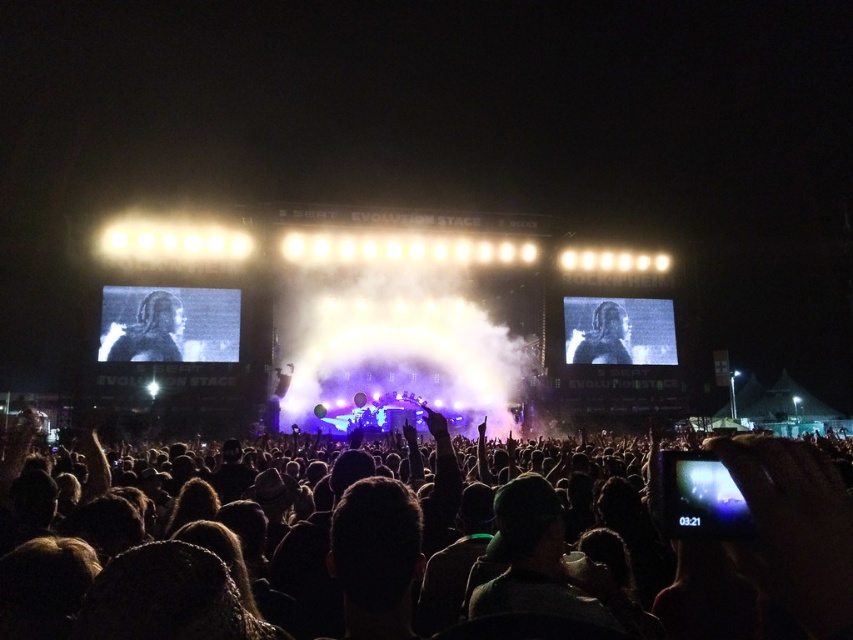
Question: Is black matte crowd at center above smooth skin face at center?

Choices:
 (A) yes
 (B) no

Answer: (B)

Question: Which of the following is the closest to the observer?

Choices:
 (A) (4, 604)
 (B) (612, 332)
 (C) (151, 320)

Answer: (A)

Question: Does black matte crowd at center have a greater width compared to gray metallic figure at center?

Choices:
 (A) yes
 (B) no

Answer: (A)

Question: Which point is farther to the camera?

Choices:
 (A) (138, 307)
 (B) (408, 504)

Answer: (A)

Question: Which is nearer to the smooth skin face at center?

Choices:
 (A) gray metallic figure at center
 (B) black matte crowd at center

Answer: (B)

Question: Is black matte crowd at center bigger than gray metallic figure at center?

Choices:
 (A) yes
 (B) no

Answer: (A)